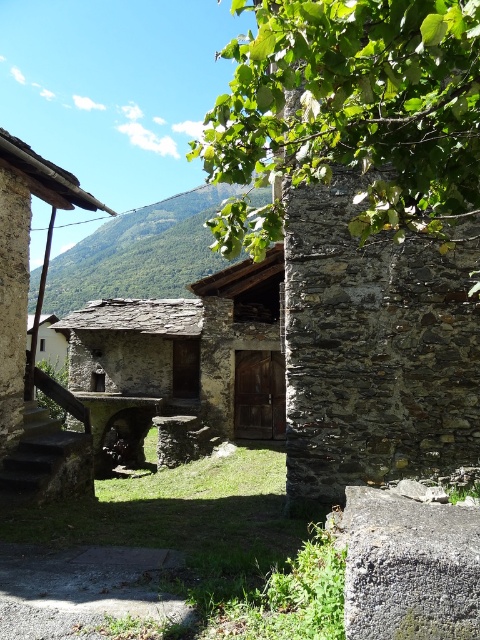
You are standing at the entrance of the rustic stone hut at center and want to look up at the green leafy tree at upper center. In which direction should you look?

You should look upward because the green leafy tree at upper center is located above the rustic stone hut at center.

You are standing at the entrance of the stone buildings and want to take a photo of the green leafy tree at upper center. Based on its position, where should you aim your camera to capture it in the frame?

The green leafy tree at upper center is located at point (357, 104), so you should aim your camera slightly to the left and lower down to capture it in the frame.

You are standing at the point labeled point (x=422, y=20) in the image. You want to walk to the nearest building entrance. Considering the distance between you and the viewer, can you estimate if you can reach the entrance within 2 meters?

The distance between point (x=422, y=20) and the viewer is 2.18 meters, so you cannot reach the entrance within 2 meters since the distance is slightly longer than 2 meters.